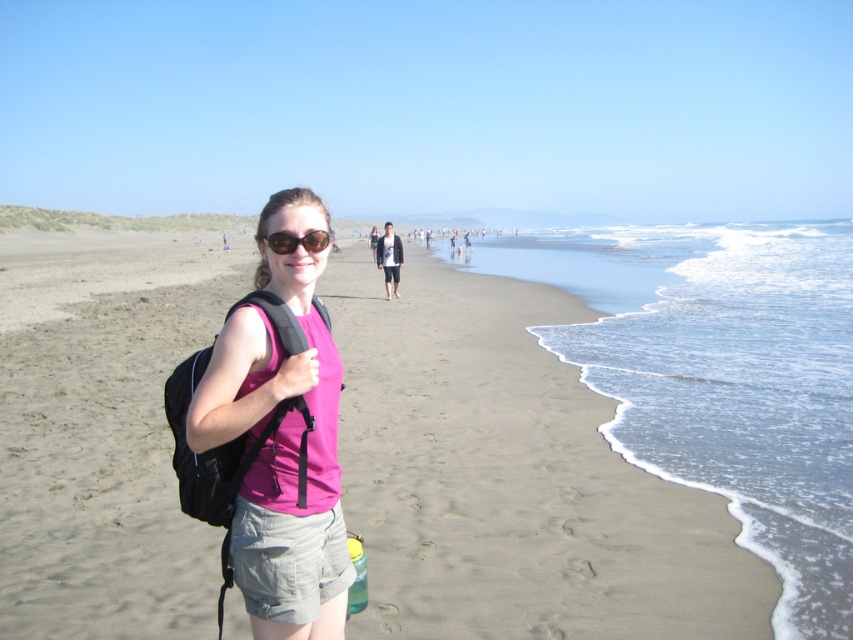
Question: Does light brown sand at center come in front of denim jacket at center?

Choices:
 (A) yes
 (B) no

Answer: (A)

Question: Does denim jacket at center appear on the right side of sunglasses at center?

Choices:
 (A) no
 (B) yes

Answer: (A)

Question: Which of the following is the farthest from the observer?

Choices:
 (A) (399, 262)
 (B) (276, 272)

Answer: (A)

Question: Which object is farther from the camera taking this photo?

Choices:
 (A) pink fabric shirt at center
 (B) sunglasses at center

Answer: (B)

Question: Is light brown sand at center bigger than pink fabric shirt at center?

Choices:
 (A) no
 (B) yes

Answer: (B)

Question: Which object appears closest to the camera in this image?

Choices:
 (A) sunglasses at center
 (B) light brown sand at center

Answer: (A)